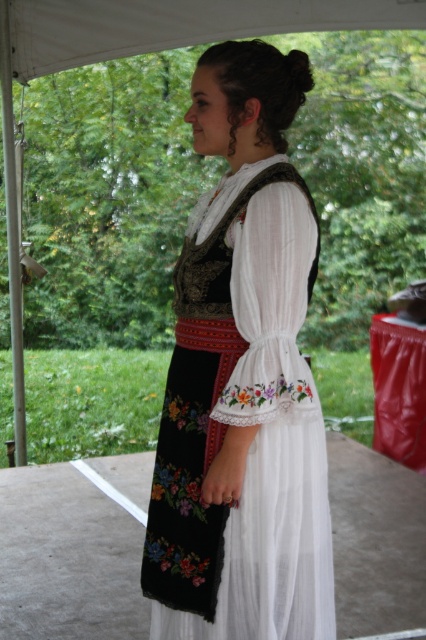
Which is below, white embroidered dress at center or white fabric canopy at upper center?

white embroidered dress at center is lower down.

Which is behind, point (276, 572) or point (36, 3)?

Positioned behind is point (36, 3).

Locate an element on the screen. Image resolution: width=426 pixels, height=640 pixels. white embroidered dress at center is located at coordinates (242, 380).